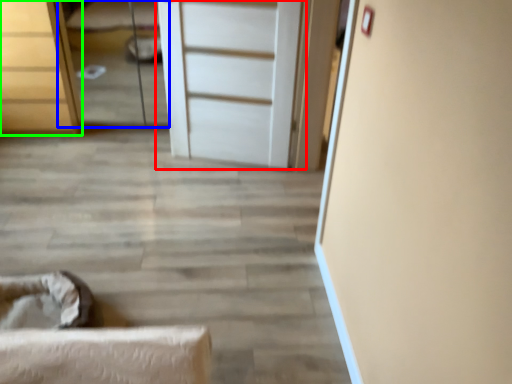
Question: Estimate the real-world distances between objects in this image. Which object is closer to door (highlighted by a red box), bed (highlighted by a blue box) or chest of drawers (highlighted by a green box)?

Choices:
 (A) bed
 (B) chest of drawers

Answer: (B)